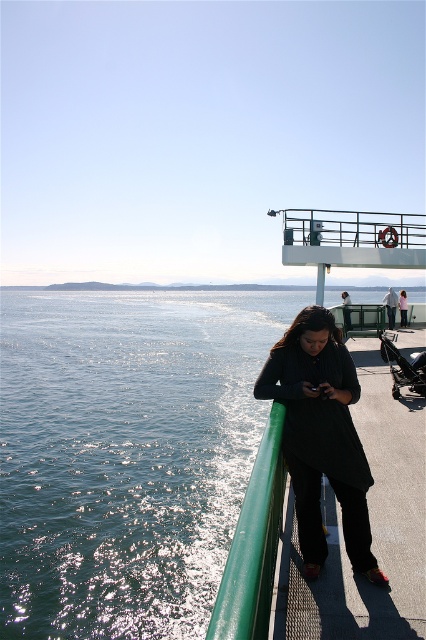
Is point (166, 600) positioned before point (388, 317)?

That is True.

Looking at this image, is shiny blue water at left behind dark gray sweater at center?

No, shiny blue water at left is closer to the viewer.

In order to click on shiny blue water at left in this screenshot , I will do `click(126, 454)`.

Is shiny blue water at left bigger than green rubber rail at lower center?

Indeed, shiny blue water at left has a larger size compared to green rubber rail at lower center.

Is shiny blue water at left further to the viewer compared to green rubber rail at lower center?

Yes, shiny blue water at left is behind green rubber rail at lower center.

Where is `shiny blue water at left`? The width and height of the screenshot is (426, 640). shiny blue water at left is located at coordinates (126, 454).

Is point (336, 410) positioned behind point (394, 292)?

That is False.

Is black matte dress at center smaller than dark gray sweater at center?

Correct, black matte dress at center occupies less space than dark gray sweater at center.

Locate an element on the screen. The image size is (426, 640). black matte dress at center is located at coordinates (321, 436).